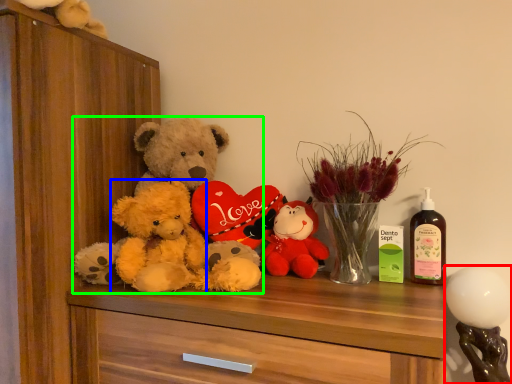
Question: Which object is positioned farthest from toy (highlighted by a red box)? Select from teddy (highlighted by a blue box) and teddy bear (highlighted by a green box).

Choices:
 (A) teddy
 (B) teddy bear

Answer: (A)